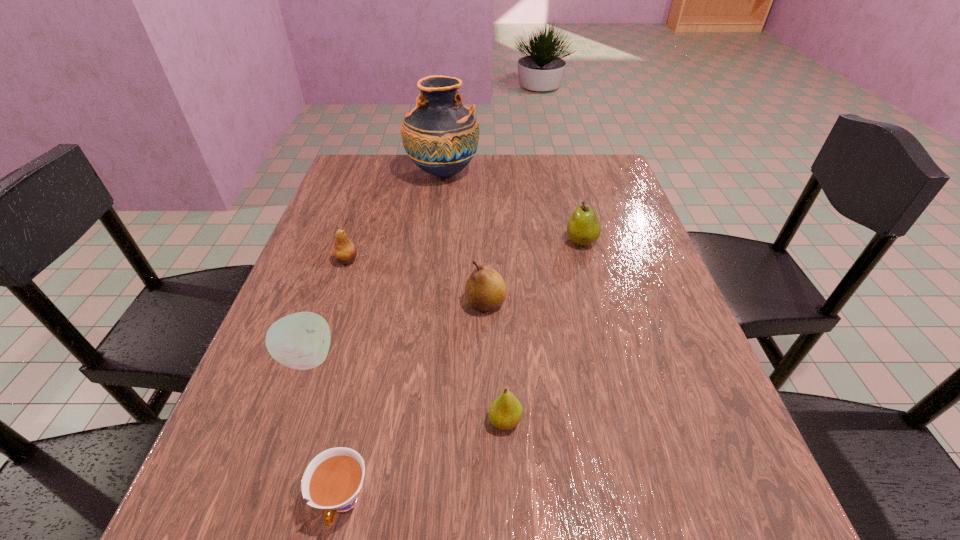
Locate an element on the screen. This screenshot has height=540, width=960. apple at the left edge is located at coordinates (301, 341).

Find the location of a particular element. This screenshot has width=960, height=540. object present at the right edge is located at coordinates (583, 228).

Locate an element on the screen. vacant space at the far edge of the desktop is located at coordinates (518, 181).

This screenshot has width=960, height=540. I want to click on vacant area at the near edge of the desktop, so click(x=623, y=537).

In the image, there is a desktop. Where is `vacant space at the left edge`? The width and height of the screenshot is (960, 540). vacant space at the left edge is located at coordinates click(306, 404).

Find the location of a particular element. The image size is (960, 540). vacant point at the right edge is located at coordinates (659, 322).

Image resolution: width=960 pixels, height=540 pixels. I want to click on vacant area at the far left corner of the desktop, so click(387, 175).

At what (x,y) coordinates should I click in order to perform the action: click on vacant region at the far right corner of the desktop. Please return your answer as a coordinate pair (x, y). The height and width of the screenshot is (540, 960). Looking at the image, I should click on (602, 171).

The width and height of the screenshot is (960, 540). I want to click on vacant region at the near right corner, so click(761, 509).

At what (x,y) coordinates should I click in order to perform the action: click on empty location between the nearest object and the third farthest object. Please return your answer as a coordinate pair (x, y). The height and width of the screenshot is (540, 960). Looking at the image, I should click on (345, 381).